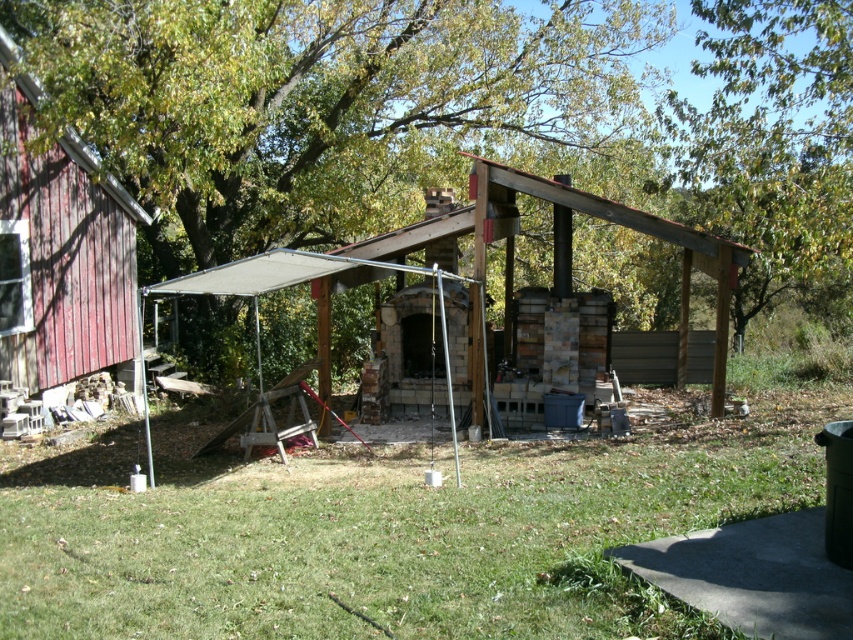
You are planning to place a large garden statue that is 2 meters wide in the scene. Based on the image, which object from the grass at lower center or wooden pergola at center would allow the statue to fit without overlapping? Explain your reasoning.

The grass at lower center has a greater width than the wooden pergola at center, so placing the 2m wide statue on the grass at lower center would provide enough space without overlapping.

You are standing at the center of the scene and want to look up at the green leafy tree at upper center. In which direction should you tilt your head?

The green leafy tree at upper center is located at point (775, 148) in the image, which is in the upper part of the scene. Therefore, you should tilt your head upward to look at the green leafy tree at upper center.